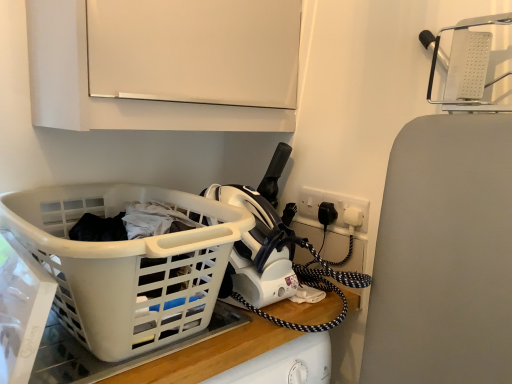
Question: Can you confirm if white matte cabinet at upper center is shorter than white plastic socket at upper right?

Choices:
 (A) no
 (B) yes

Answer: (A)

Question: Is white matte cabinet at upper center facing away from white plastic socket at upper right?

Choices:
 (A) yes
 (B) no

Answer: (B)

Question: Does white matte cabinet at upper center come in front of white plastic socket at upper right?

Choices:
 (A) yes
 (B) no

Answer: (A)

Question: Considering the relative sizes of white matte cabinet at upper center and white plastic socket at upper right in the image provided, is white matte cabinet at upper center bigger than white plastic socket at upper right?

Choices:
 (A) yes
 (B) no

Answer: (A)

Question: Is white plastic socket at upper right located within white matte cabinet at upper center?

Choices:
 (A) yes
 (B) no

Answer: (B)

Question: Choose the correct answer: Is white plastic laundry basket at lower left inside white matte cabinet at upper center or outside it?

Choices:
 (A) inside
 (B) outside

Answer: (B)

Question: In terms of width, does white plastic laundry basket at lower left look wider or thinner when compared to white matte cabinet at upper center?

Choices:
 (A) thin
 (B) wide

Answer: (B)

Question: Considering the relative positions of white plastic laundry basket at lower left and white matte cabinet at upper center in the image provided, is white plastic laundry basket at lower left to the left or to the right of white matte cabinet at upper center?

Choices:
 (A) right
 (B) left

Answer: (B)

Question: Considering their positions, is white plastic laundry basket at lower left located in front of or behind white matte cabinet at upper center?

Choices:
 (A) behind
 (B) front

Answer: (B)

Question: Based on their sizes in the image, would you say white plastic laundry basket at lower left is bigger or smaller than white plastic socket at upper right?

Choices:
 (A) small
 (B) big

Answer: (B)

Question: Is point (10, 218) closer or farther from the camera than point (309, 198)?

Choices:
 (A) farther
 (B) closer

Answer: (B)

Question: From a real-world perspective, is white plastic laundry basket at lower left physically located above or below white plastic socket at upper right?

Choices:
 (A) below
 (B) above

Answer: (A)

Question: Is white plastic laundry basket at lower left to the left or to the right of white plastic socket at upper right in the image?

Choices:
 (A) right
 (B) left

Answer: (B)

Question: Does point (193, 26) appear closer or farther from the camera than point (309, 198)?

Choices:
 (A) farther
 (B) closer

Answer: (B)

Question: Is white matte cabinet at upper center in front of or behind white plastic socket at upper right in the image?

Choices:
 (A) front
 (B) behind

Answer: (A)